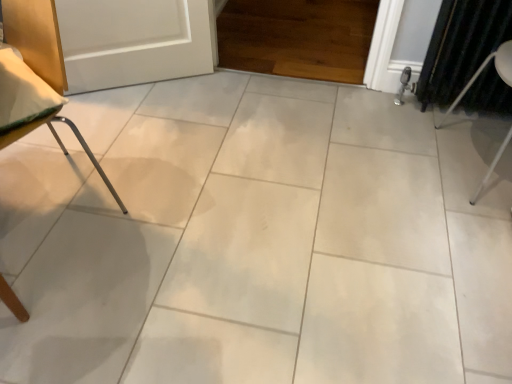
This screenshot has width=512, height=384. In order to click on free point below metallic silver chair leg at left, positioned as the second furniture in right-to-left order (from a real-world perspective) in this screenshot , I will do `click(54, 200)`.